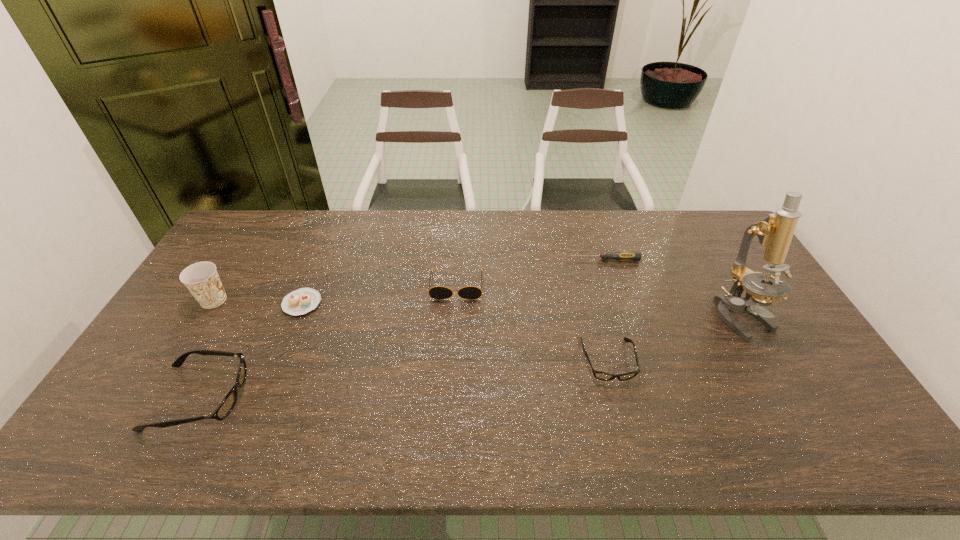
The height and width of the screenshot is (540, 960). I want to click on the left spectacles, so click(x=226, y=406).

I want to click on the shorter spectacles, so click(603, 376).

At what (x,y) coordinates should I click in order to perform the action: click on the farthest object. Please return your answer as a coordinate pair (x, y). This screenshot has height=540, width=960. Looking at the image, I should click on 620,255.

Find the location of a particular element. screwdriver is located at coordinates (620, 255).

Where is `microscope`? microscope is located at coordinates (775, 232).

Find the location of a particular element. the tallest object is located at coordinates (775, 232).

The image size is (960, 540). Identify the location of sunglasses. (438, 292).

I want to click on the second tallest object, so click(201, 279).

I want to click on cupcake, so click(301, 301).

Where is `vacant space located 0.400m on the front-facing side of the taller spectacles`? This screenshot has width=960, height=540. vacant space located 0.400m on the front-facing side of the taller spectacles is located at coordinates (404, 397).